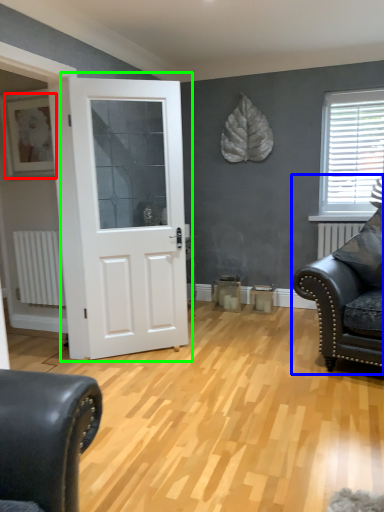
Question: Considering the real-world distances, which object is closest to picture frame (highlighted by a red box)? studio couch (highlighted by a blue box) or door (highlighted by a green box).

Choices:
 (A) studio couch
 (B) door

Answer: (B)